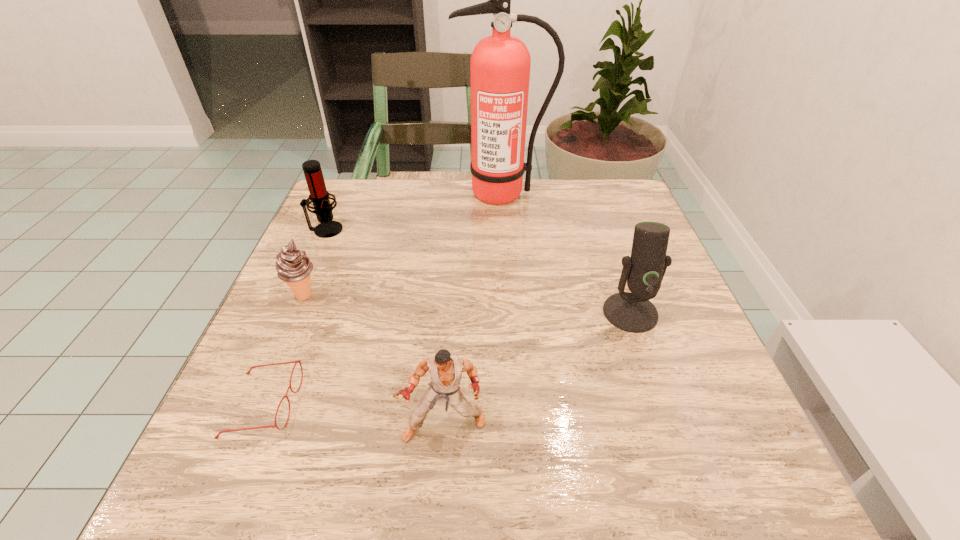
Locate an element on the screen. The width and height of the screenshot is (960, 540). the farthest object is located at coordinates (500, 64).

Identify the location of the tallest object. (500, 64).

Identify the location of the rightmost object. (632, 312).

At what (x,y) coordinates should I click in order to perform the action: click on the nearer microphone. Please return your answer as a coordinate pair (x, y). Looking at the image, I should click on (632, 312).

Identify the location of the farther microphone. The height and width of the screenshot is (540, 960). (319, 196).

Locate an element on the screen. the left microphone is located at coordinates (319, 196).

At what (x,y) coordinates should I click in order to perform the action: click on puncher. Please return your answer as a coordinate pair (x, y). Looking at the image, I should click on (446, 371).

The width and height of the screenshot is (960, 540). What are the coordinates of `icecream` in the screenshot? It's located at (293, 266).

You are a GUI agent. You are given a task and a screenshot of the screen. Output one action in this format:
    pyautogui.click(x=<x>, y=<y>)
    Task: Click on the shortest object
    
    Given the screenshot: What is the action you would take?
    pyautogui.click(x=298, y=361)

Locate an element on the screen. Image resolution: width=960 pixels, height=540 pixels. vacant space situated 0.110m on the handle side of the farthest object is located at coordinates (505, 233).